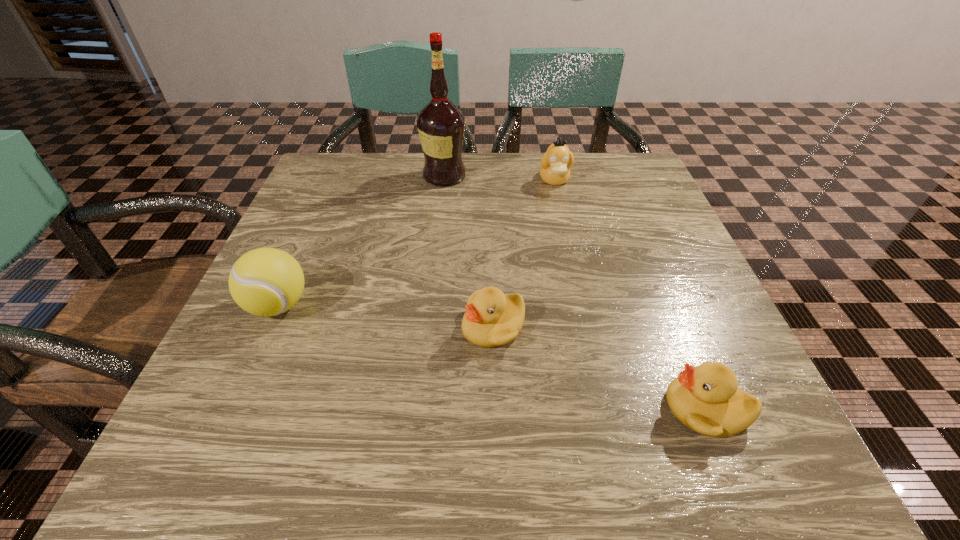
Where is `object positioned at the near edge`? This screenshot has width=960, height=540. object positioned at the near edge is located at coordinates [x=706, y=399].

Locate an element on the screen. The width and height of the screenshot is (960, 540). object at the left edge is located at coordinates (266, 281).

Locate an element on the screen. The image size is (960, 540). object that is at the right edge is located at coordinates (706, 399).

This screenshot has width=960, height=540. Find the location of `object at the near right corner`. object at the near right corner is located at coordinates [706, 399].

Locate an element on the screen. The image size is (960, 540). blank space at the far edge of the desktop is located at coordinates (501, 161).

In the image, there is a desktop. Identify the location of vacant space at the left edge. The width and height of the screenshot is (960, 540). (265, 404).

Where is `vacant region at the right edge of the desktop`? This screenshot has height=540, width=960. vacant region at the right edge of the desktop is located at coordinates (630, 309).

The image size is (960, 540). I want to click on free space at the far left corner of the desktop, so click(x=376, y=153).

Find the location of a particular element. free space at the far right corner of the desktop is located at coordinates (642, 164).

Locate an element on the screen. This screenshot has width=960, height=540. blank region between the fourth object from right to left and the leftmost duckling is located at coordinates coord(468,252).